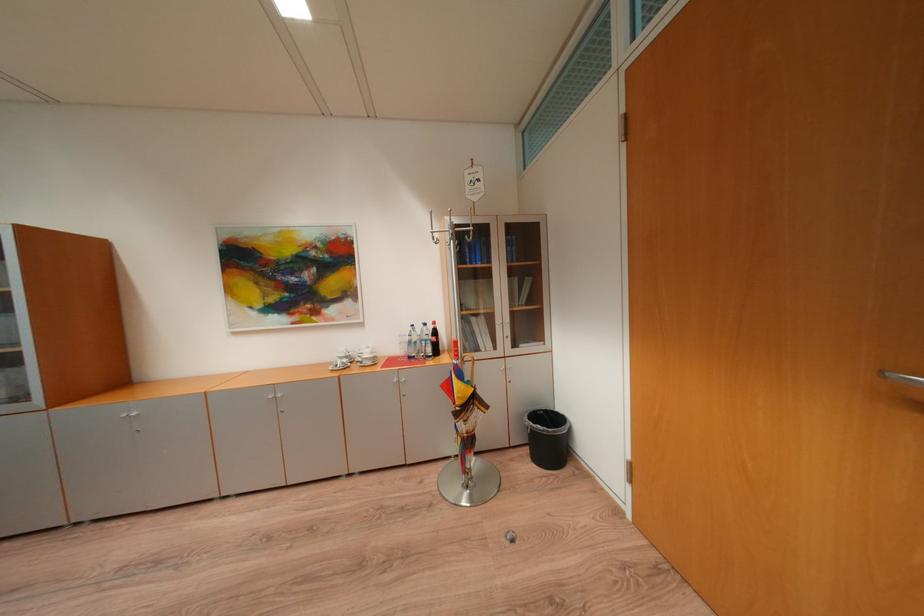
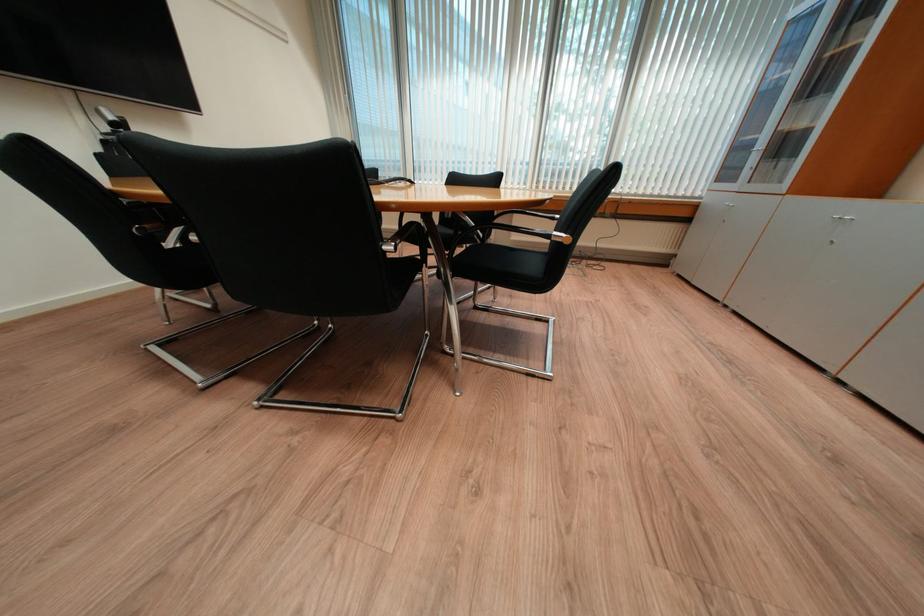
The first image is from the beginning of the video and the second image is from the end. How did the camera likely rotate when shooting the video?

The camera rotated toward left-down.